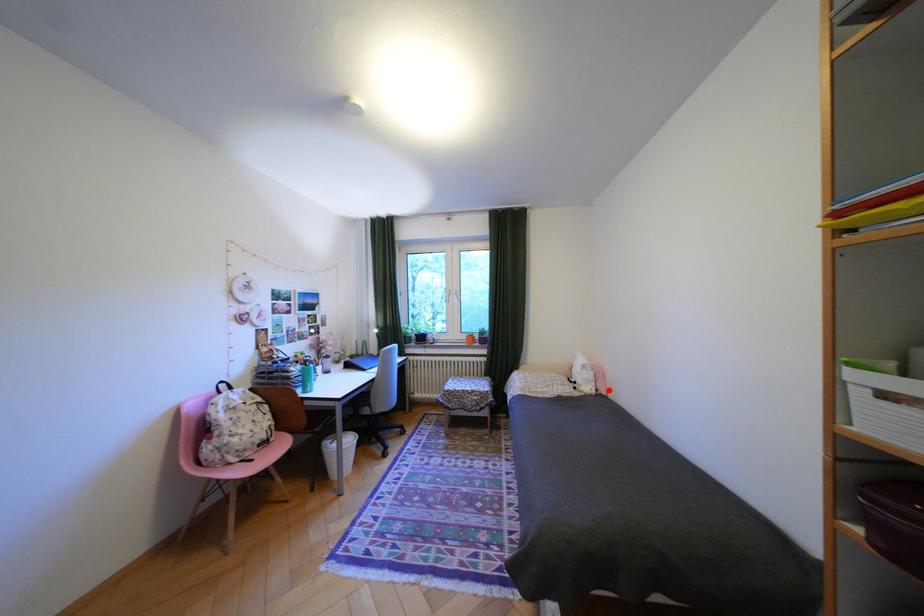
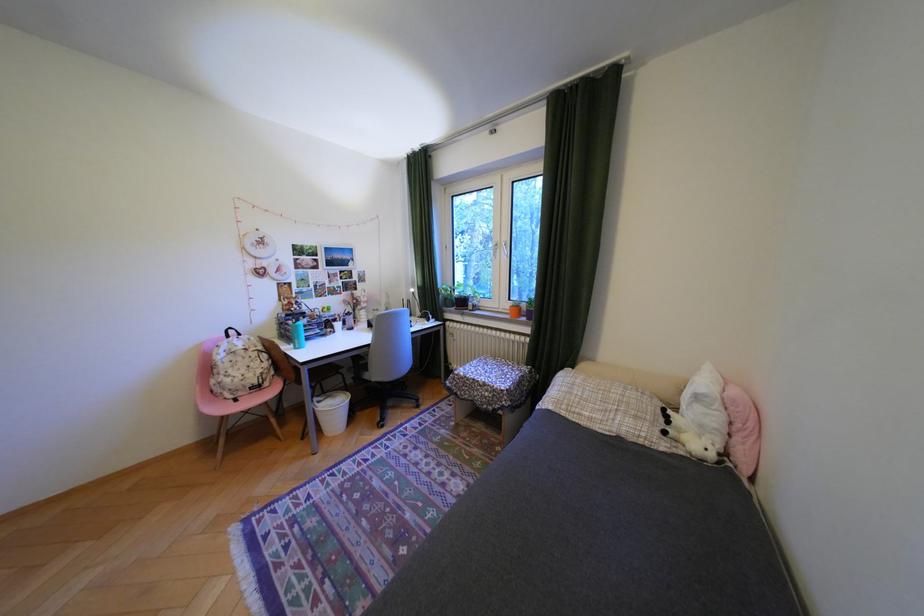
Find the pixel in the second image that matches the highlighted location in the first image.

(736, 455)